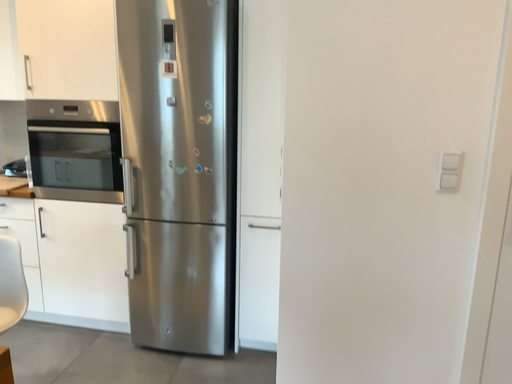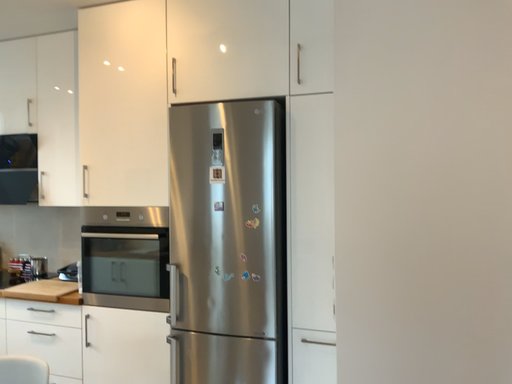
Question: Which way did the camera rotate in the video?

Choices:
 (A) rotated downward
 (B) rotated upward

Answer: (B)